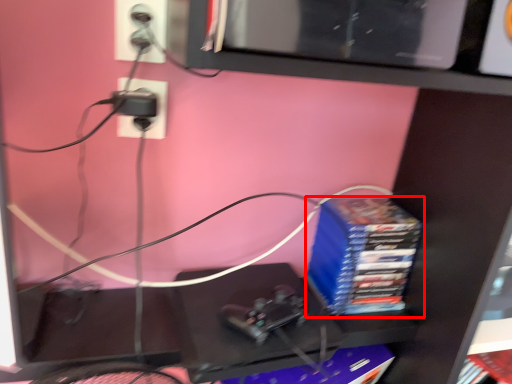
Question: From the image's perspective, where is paperback book (annotated by the red box) located in relation to paperback book in the image?

Choices:
 (A) above
 (B) below

Answer: (A)